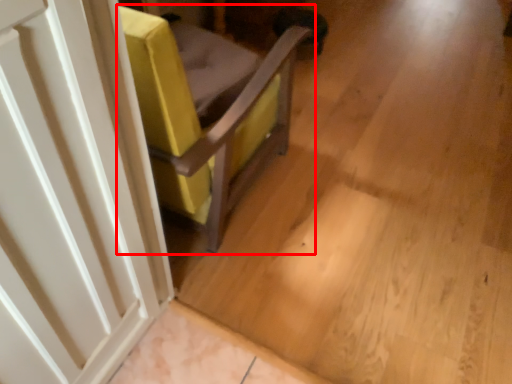
Question: From the image's perspective, where is furniture (annotated by the red box) located in relation to door in the image?

Choices:
 (A) below
 (B) above

Answer: (B)